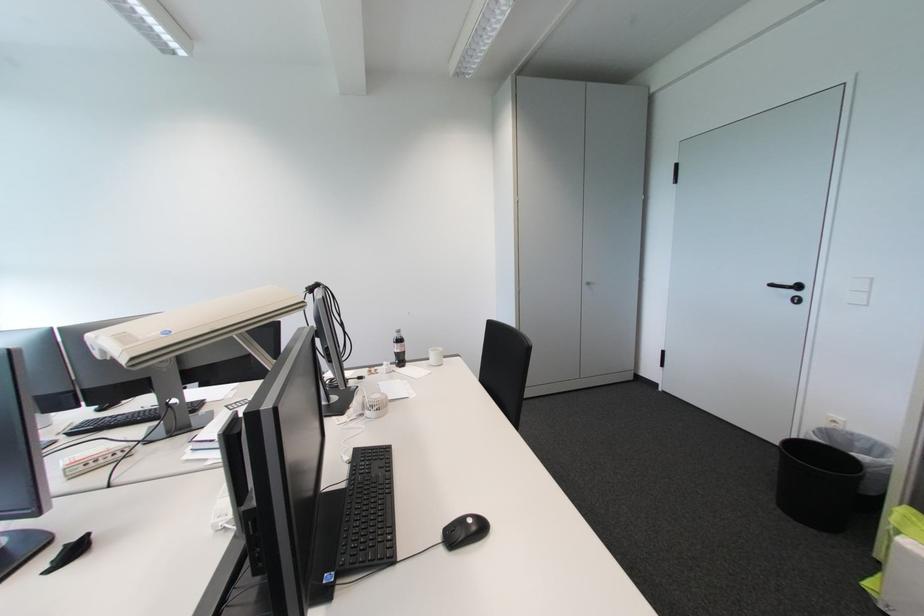
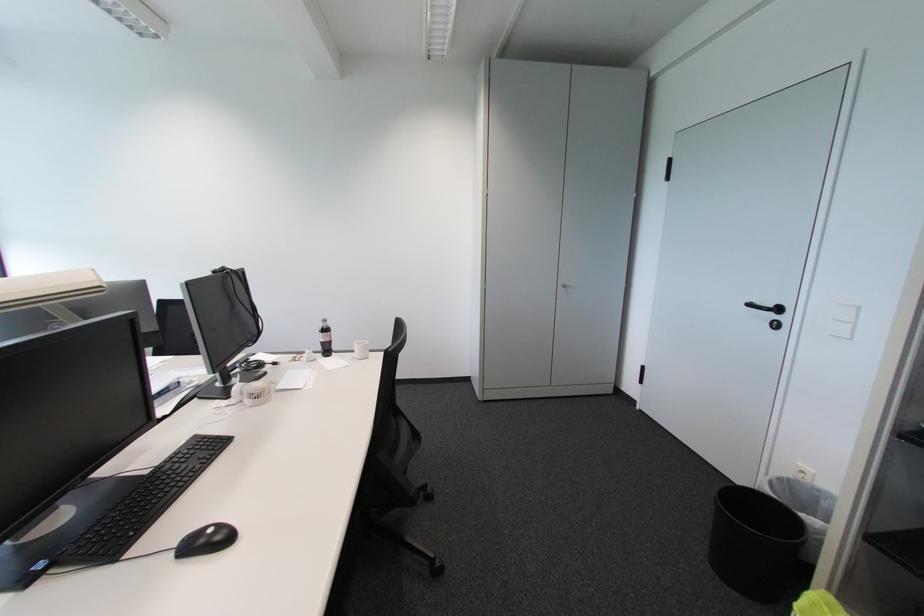
Question: What movement of the cameraman would produce the second image?

Choices:
 (A) Left
 (B) Right
 (C) Forward
 (D) Backward

Answer: (B)